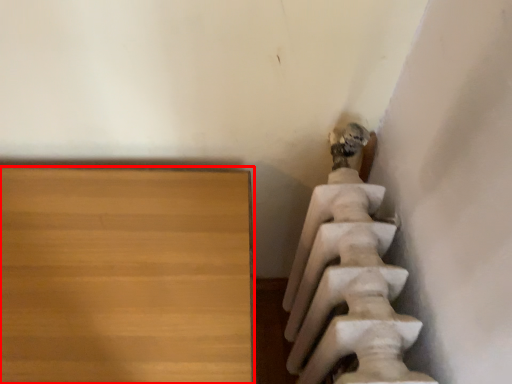
Question: Observing the image, what is the correct spatial positioning of furniture (annotated by the red box) in reference to statue (sculpture)?

Choices:
 (A) left
 (B) right

Answer: (A)